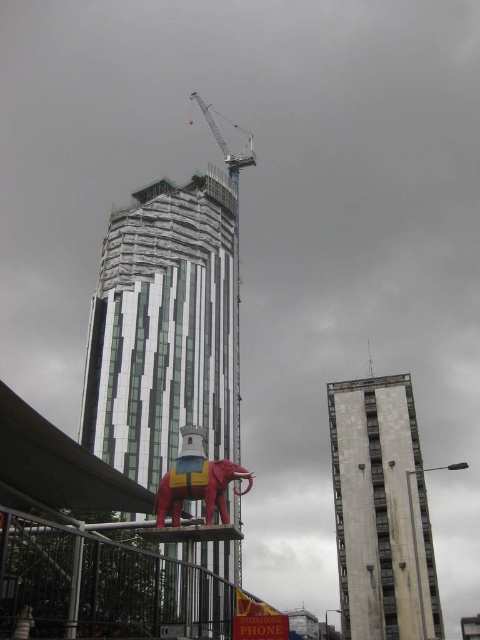
You are standing in the urban scene and want to take a photo of both point [107,305] and point [208,513]. Which point is closer to your camera?

Point [107,305] is further to the camera than point [208,513], so the point closer to your camera is point [208,513].

You are standing in the middle of a city park and see the white marble building at center and the shiny red elephant at center. Which object is closer to the ground?

The white marble building at center is positioned under the shiny red elephant at center, so the white marble building at center is closer to the ground.